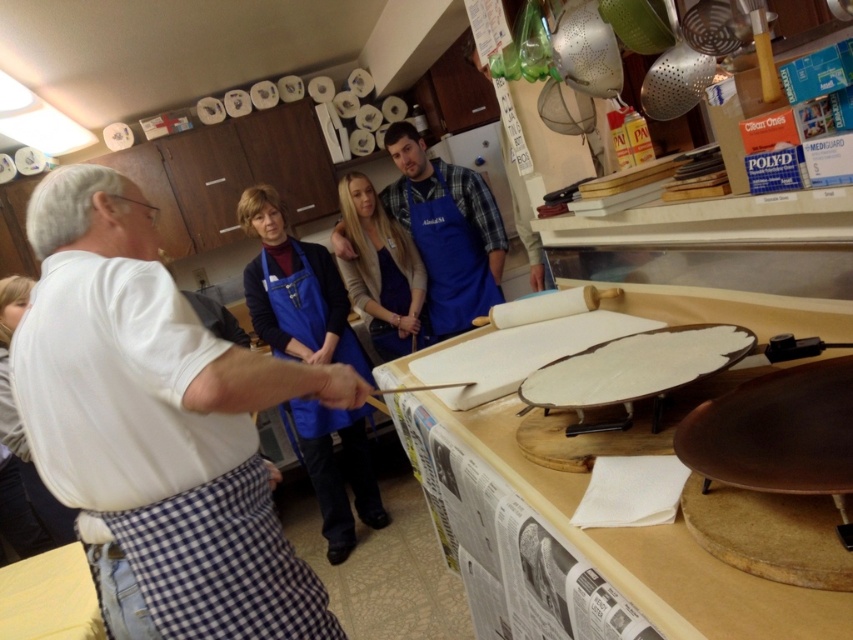
Question: Observing the image, what is the correct spatial positioning of white checkered apron at left in reference to white matte plate at center?

Choices:
 (A) left
 (B) right

Answer: (A)

Question: Can you confirm if white checkered apron at left is positioned to the left of blue fabric apron at center?

Choices:
 (A) no
 (B) yes

Answer: (B)

Question: Among these objects, which one is nearest to the camera?

Choices:
 (A) white matte plate at center
 (B) white checkered apron at left
 (C) blue apron at center

Answer: (B)

Question: Which point is closer to the camera taking this photo?

Choices:
 (A) (709, 369)
 (B) (160, 388)
 (C) (416, 211)

Answer: (A)

Question: Is white checkered apron at left thinner than white matte plate at center?

Choices:
 (A) no
 (B) yes

Answer: (A)

Question: Which of the following is the farthest from the observer?

Choices:
 (A) (485, 292)
 (B) (206, 556)
 (C) (436, 300)
 (D) (635, 372)

Answer: (C)